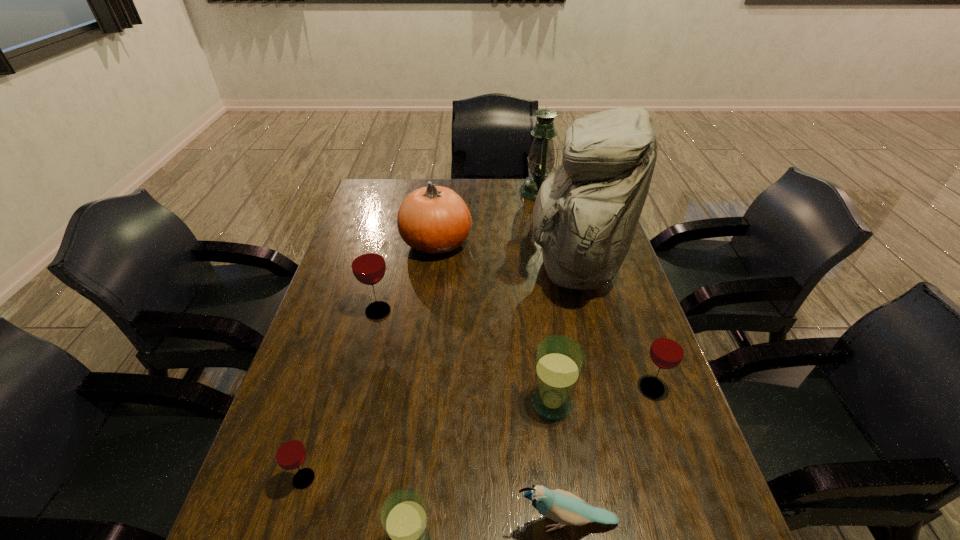
Identify the location of vacant region between the smallest red glass and the pumpkin. (371, 361).

Choose which object is the sixth nearest neighbor to the smallest red glass. Please provide its 2D coordinates. Your answer should be formatted as a tuple, i.e. [(x, y)], where the tuple contains the x and y coordinates of a point satisfying the conditions above.

[(434, 220)]

Identify which object is located as the fourth nearest to the orange pumpkin. Please provide its 2D coordinates. Your answer should be formatted as a tuple, i.e. [(x, y)], where the tuple contains the x and y coordinates of a point satisfying the conditions above.

[(559, 360)]

Select which glass appears as the third closest to the biggest red glass. Please provide its 2D coordinates. Your answer should be formatted as a tuple, i.e. [(x, y)], where the tuple contains the x and y coordinates of a point satisfying the conditions above.

[(404, 517)]

Locate which glass ranks fourth in proximity to the backpack. Please provide its 2D coordinates. Your answer should be formatted as a tuple, i.e. [(x, y)], where the tuple contains the x and y coordinates of a point satisfying the conditions above.

[(404, 517)]

Identify which red glass is the nearest to the backpack. Please provide its 2D coordinates. Your answer should be formatted as a tuple, i.e. [(x, y)], where the tuple contains the x and y coordinates of a point satisfying the conditions above.

[(667, 350)]

Identify which red glass is the nearest to the farther blue glass. Please provide its 2D coordinates. Your answer should be formatted as a tuple, i.e. [(x, y)], where the tuple contains the x and y coordinates of a point satisfying the conditions above.

[(667, 350)]

You are a GUI agent. You are given a task and a screenshot of the screen. Output one action in this format:
    pyautogui.click(x=<x>, y=<y>)
    Task: Click on the free space that satisfies the following two spatial constraints: 1. on the front side of the rightmost red glass; 2. on the left side of the pumpkin
    The image size is (960, 540).
    Given the screenshot: What is the action you would take?
    pyautogui.click(x=419, y=387)